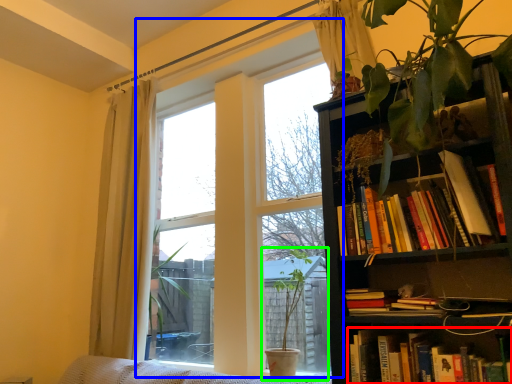
Question: Considering the real-world distances, which object is farthest from book (highlighted by a red box)? window (highlighted by a blue box) or houseplant (highlighted by a green box)?

Choices:
 (A) window
 (B) houseplant

Answer: (A)